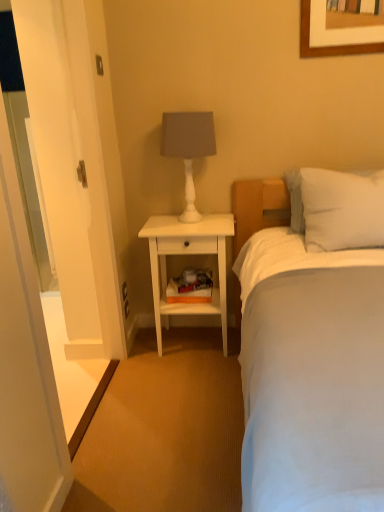
The image size is (384, 512). Identify the location of blank space situated above white wood nightstand at center (from a real-world perspective). (182, 222).